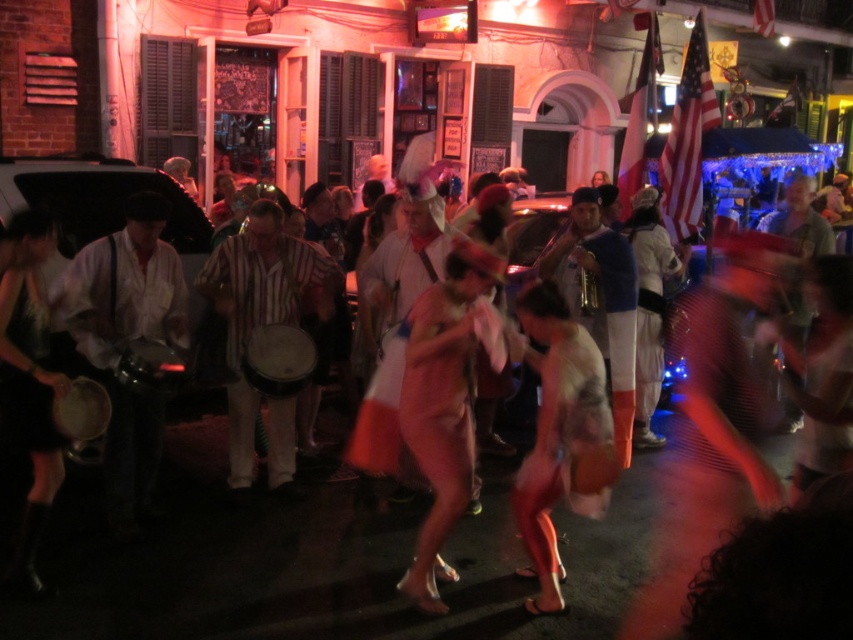
What is located at the coordinates point (260, 307) in the image?

The point (260, 307) corresponds to the striped fabric drum at center.